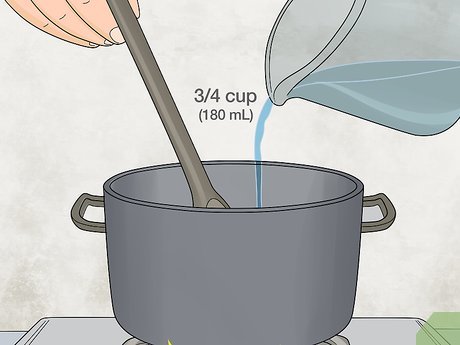
The height and width of the screenshot is (345, 460). Find the location of `stovetop`. stovetop is located at coordinates (77, 333).